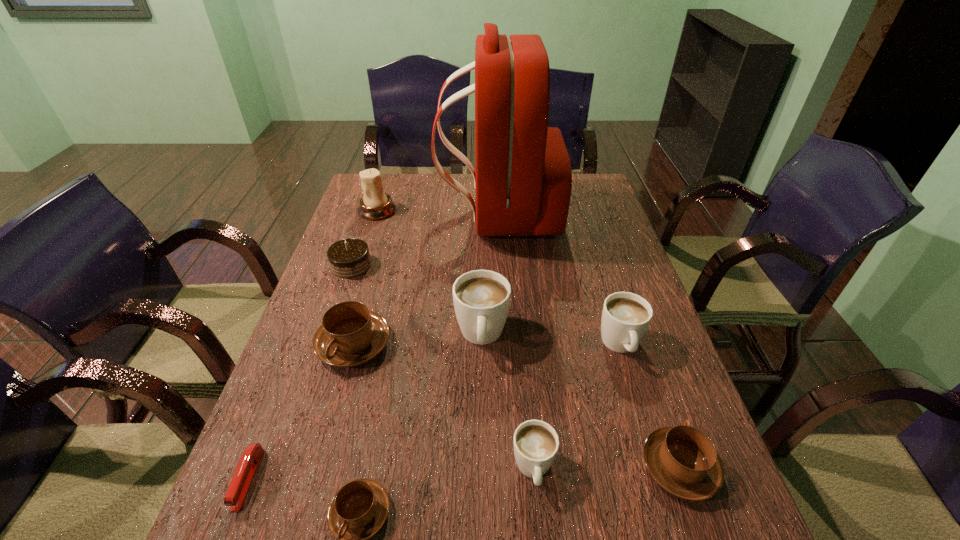
Image resolution: width=960 pixels, height=540 pixels. In order to click on vacant space that satisfies the following two spatial constraints: 1. on the side of the second smallest brown cappuccino with the handle; 2. on the strap side of the backpack in this screenshot , I will do `click(592, 215)`.

At what (x,y) coordinates should I click in order to perform the action: click on vacant space that satisfies the following two spatial constraints: 1. on the strap side of the tallest object; 2. on the side of the biggest brown cappuccino with the handle. Please return your answer as a coordinate pair (x, y). Looking at the image, I should click on (506, 344).